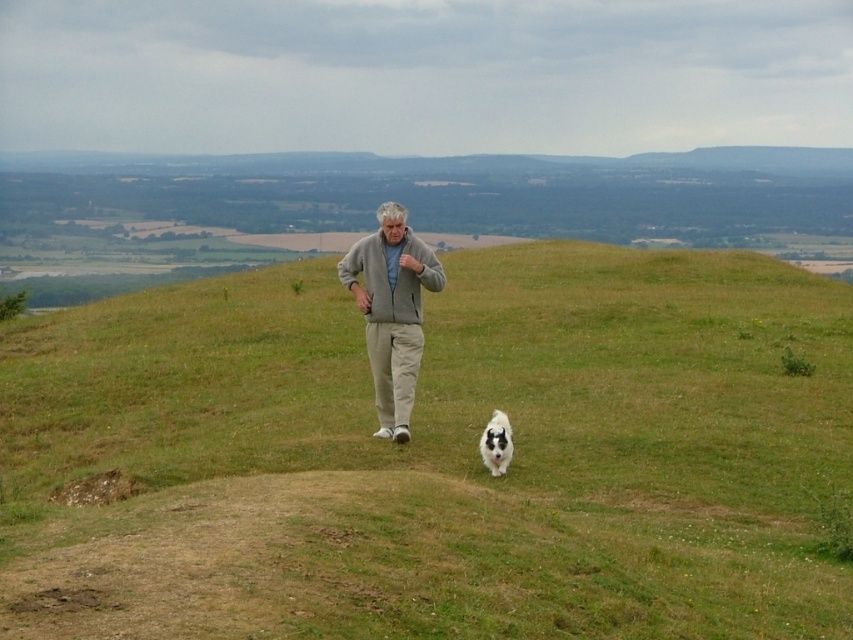
What is the 2D coordinate of the green grassy hill at center?

The 2D coordinate of the green grassy hill at center is at point (436, 456).